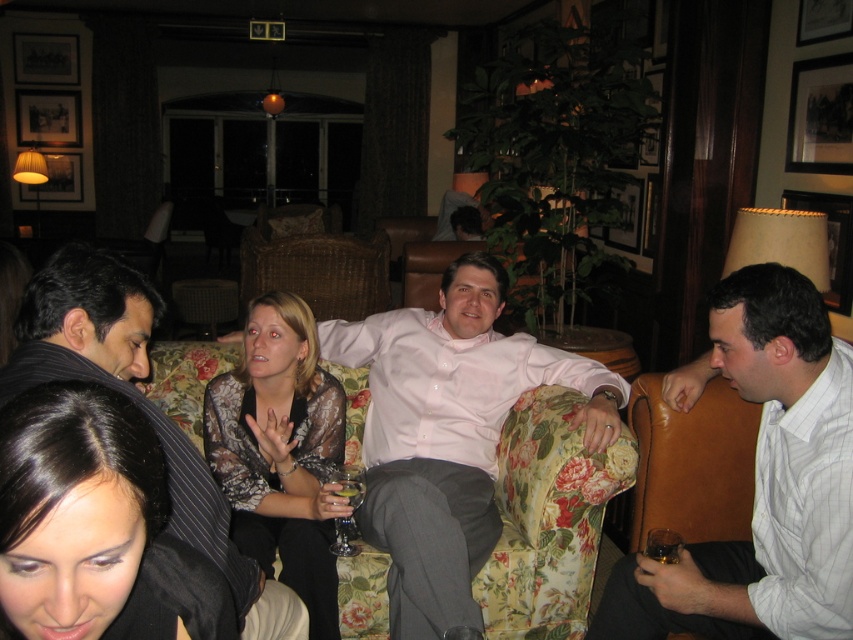
Question: Based on their relative distances, which object is nearer to the pink satin shirt at center?

Choices:
 (A) white striped shirt at right
 (B) translucent glass at lower right
 (C) pink cotton shirt at center
 (D) clear glass wine glass at lower center

Answer: (D)

Question: Which of the following is the closest to the observer?

Choices:
 (A) (346, 481)
 (B) (347, 484)
 (C) (688, 573)
 (D) (259, 394)

Answer: (C)

Question: Does white striped shirt at right have a larger size compared to printed silk blouse at center?

Choices:
 (A) yes
 (B) no

Answer: (B)

Question: Where is clear glass wine glass at lower center located in relation to translucent glass at lower center in the image?

Choices:
 (A) left
 (B) right

Answer: (A)

Question: Can you confirm if white striped shirt at right is wider than pink cotton shirt at center?

Choices:
 (A) no
 (B) yes

Answer: (A)

Question: Which point is farther from the camera taking this photo?

Choices:
 (A) (347, 502)
 (B) (345, 483)
 (C) (399, 540)

Answer: (B)